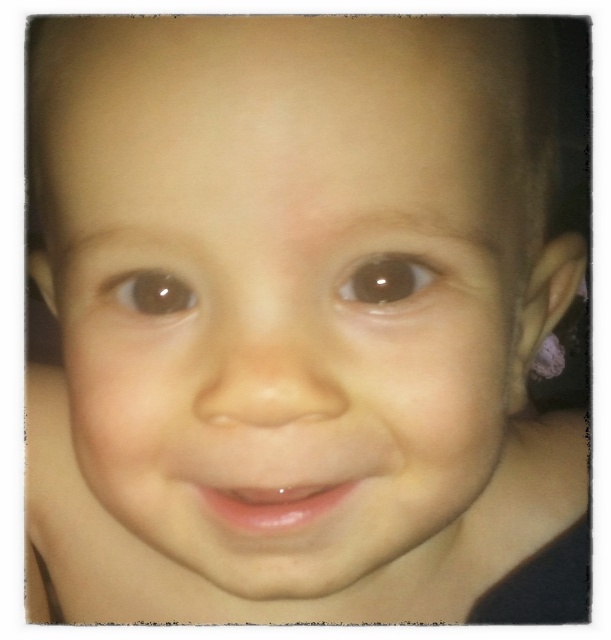
Question: Which point is farther to the camera?

Choices:
 (A) (368, 305)
 (B) (153, 269)

Answer: (B)

Question: Which object is closer to the camera taking this photo?

Choices:
 (A) brown glossy eye at center
 (B) brown glossy eye at upper left

Answer: (A)

Question: Can you confirm if brown glossy eye at center is thinner than brown glossy eye at upper left?

Choices:
 (A) no
 (B) yes

Answer: (B)

Question: Among these objects, which one is farthest from the camera?

Choices:
 (A) brown glossy eye at center
 (B) brown glossy eye at upper left

Answer: (B)

Question: Can you confirm if brown glossy eye at center is positioned to the left of brown glossy eye at upper left?

Choices:
 (A) yes
 (B) no

Answer: (B)

Question: Considering the relative positions of brown glossy eye at center and brown glossy eye at upper left in the image provided, where is brown glossy eye at center located with respect to brown glossy eye at upper left?

Choices:
 (A) above
 (B) below

Answer: (A)